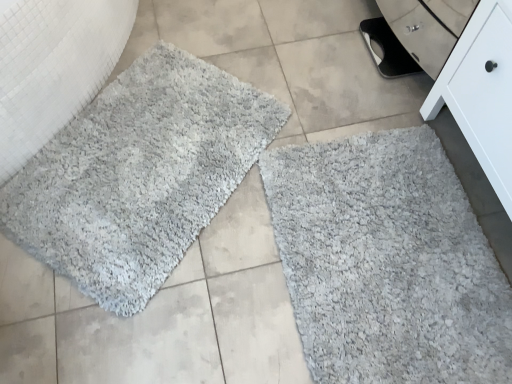
Question: Does white matte cabinet at lower right have a lesser height compared to gray shaggy rug at upper left, acting as the 1th bath mat starting from the left?

Choices:
 (A) yes
 (B) no

Answer: (B)

Question: Could you tell me if white matte cabinet at lower right is turned towards gray shaggy rug at upper left, which is the second bath mat in right-to-left order?

Choices:
 (A) yes
 (B) no

Answer: (A)

Question: Is gray shaggy rug at upper left, acting as the 1th bath mat starting from the left, surrounded by white matte cabinet at lower right?

Choices:
 (A) yes
 (B) no

Answer: (B)

Question: Is white matte cabinet at lower right turned away from gray shaggy rug at upper left, acting as the 1th bath mat starting from the left?

Choices:
 (A) no
 (B) yes

Answer: (A)

Question: Is white matte cabinet at lower right smaller than gray shaggy rug at upper left, which is the second bath mat in right-to-left order?

Choices:
 (A) no
 (B) yes

Answer: (A)

Question: Visually, is gray shaggy bath mat at lower right, marked as the second bath mat in a left-to-right arrangement, positioned to the left or to the right of gray shaggy rug at upper left, which is the second bath mat in right-to-left order?

Choices:
 (A) left
 (B) right

Answer: (B)

Question: Is gray shaggy bath mat at lower right, which appears as the first bath mat when viewed from the right, taller or shorter than gray shaggy rug at upper left, acting as the 1th bath mat starting from the left?

Choices:
 (A) tall
 (B) short

Answer: (B)

Question: Considering the positions of point (309, 317) and point (138, 296), is point (309, 317) closer or farther from the camera than point (138, 296)?

Choices:
 (A) farther
 (B) closer

Answer: (B)

Question: From a real-world perspective, relative to gray shaggy rug at upper left, which is the second bath mat in right-to-left order, is gray shaggy bath mat at lower right, marked as the second bath mat in a left-to-right arrangement, vertically above or below?

Choices:
 (A) above
 (B) below

Answer: (A)

Question: Is white matte cabinet at lower right in front of or behind gray shaggy rug at upper left, acting as the 1th bath mat starting from the left, in the image?

Choices:
 (A) front
 (B) behind

Answer: (A)

Question: Does point (501, 61) appear closer or farther from the camera than point (117, 190)?

Choices:
 (A) farther
 (B) closer

Answer: (B)

Question: Considering the positions of white matte cabinet at lower right and gray shaggy rug at upper left, acting as the 1th bath mat starting from the left, in the image, is white matte cabinet at lower right taller or shorter than gray shaggy rug at upper left, acting as the 1th bath mat starting from the left,?

Choices:
 (A) short
 (B) tall

Answer: (B)

Question: Looking at their shapes, would you say white matte cabinet at lower right is wider or thinner than gray shaggy rug at upper left, acting as the 1th bath mat starting from the left?

Choices:
 (A) thin
 (B) wide

Answer: (A)

Question: From the image's perspective, is white matte cabinet at lower right located above or below gray shaggy bath mat at lower right, which appears as the first bath mat when viewed from the right?

Choices:
 (A) below
 (B) above

Answer: (B)

Question: In the image, is white matte cabinet at lower right positioned in front of or behind gray shaggy bath mat at lower right, marked as the second bath mat in a left-to-right arrangement?

Choices:
 (A) front
 (B) behind

Answer: (A)